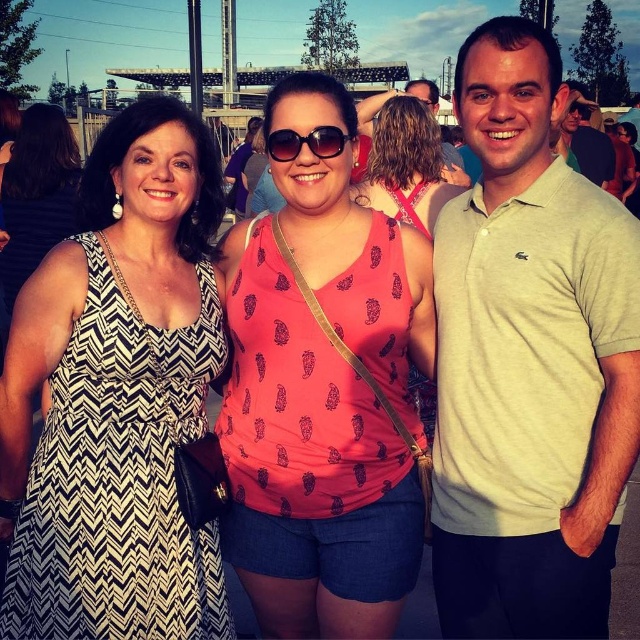
You are standing in front of the group of three people in the image. There are two points marked on the image at coordinates point [477,108] and point [588,125]. Which of these two points is closer to you?

Point [477,108] is closer to the viewer than point [588,125].

You are taking a photo of two points in the image. Point A is at coordinate point (161, 564) and Point B is at coordinate point (387, 531). Which point is closer to the camera?

Point A at coordinate point (161, 564) is closer to the camera than point B at coordinate point (387, 531).